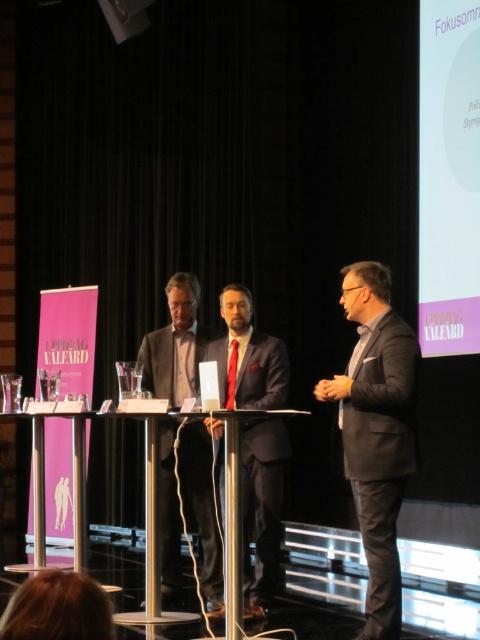
You are a photographer at the back of the stage. You need to capture a clear photo of both the dark gray suit at right and the dark gray wool suit at center. Which one will appear taller in the photo?

The dark gray wool suit at center will appear taller in the photo because it is taller than the dark gray suit at right.